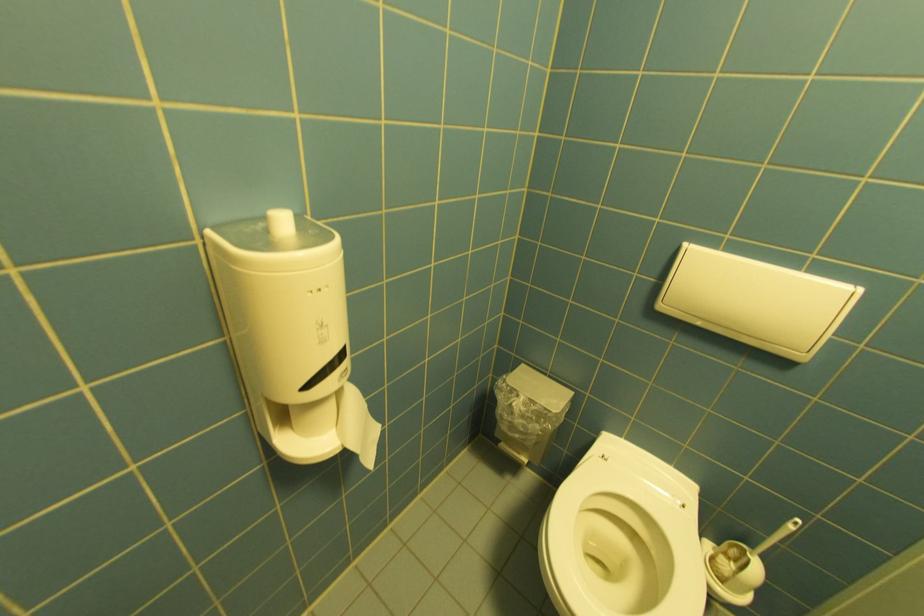
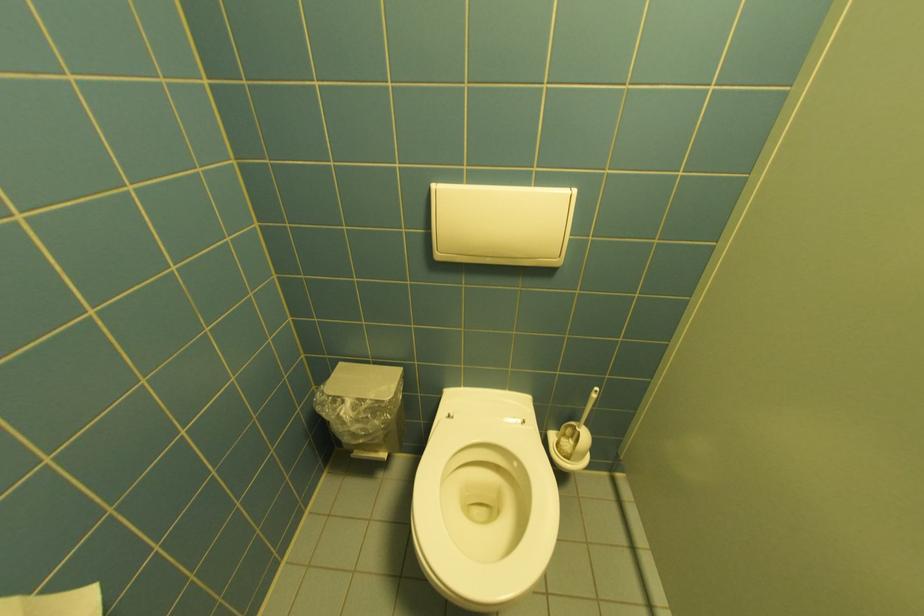
Locate, in the second image, the point that corresponds to point (529, 367) in the first image.

(347, 365)